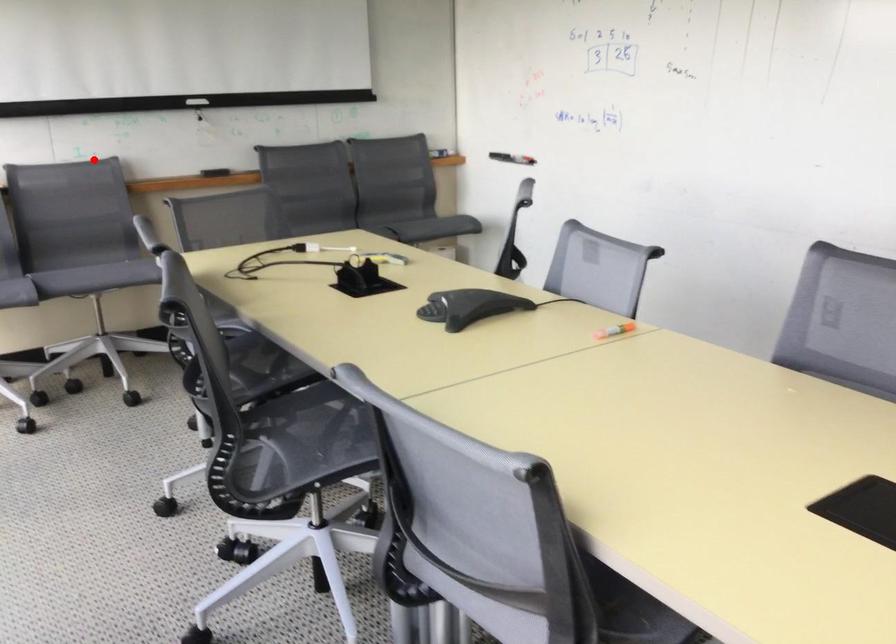
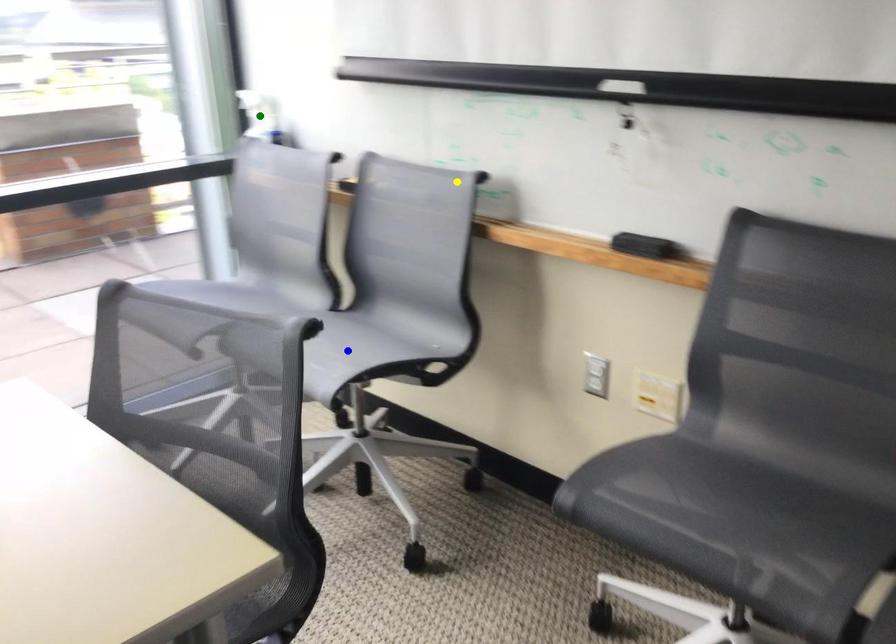
Question: I am providing you with two images of the same scene from different viewpoints. A red point is marked on the first image. You are given multiple points on the second image. Which spot in image 2 lines up with the point in image 1?

Choices:
 (A) yellow point
 (B) blue point
 (C) green point

Answer: (A)